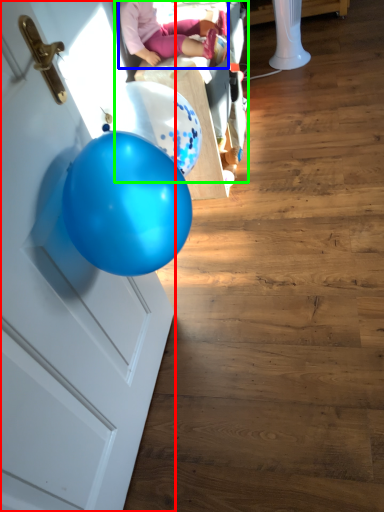
Question: Which object is positioned closest to door (highlighted by a red box)? Select from person (highlighted by a blue box) and baby carriage (highlighted by a green box).

Choices:
 (A) person
 (B) baby carriage

Answer: (A)